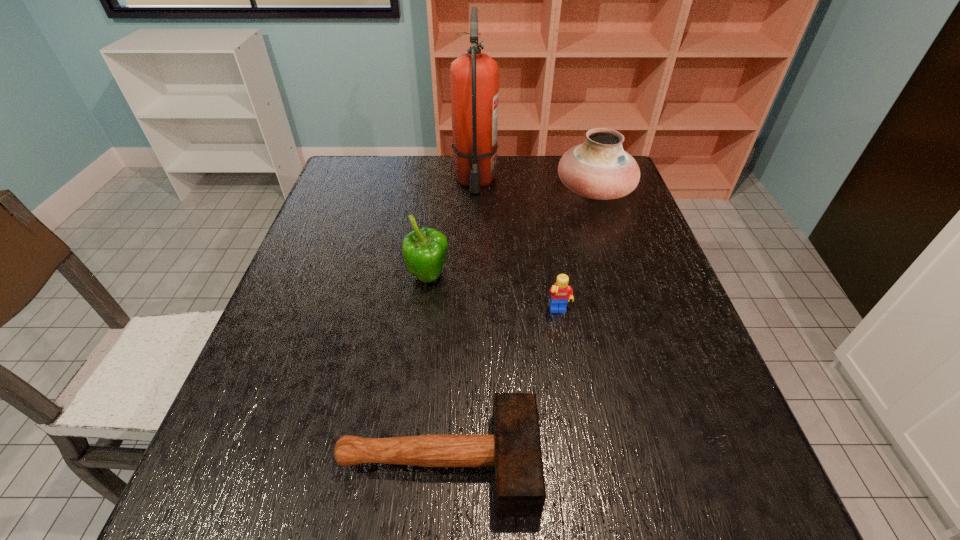
Locate an element on the screen. the fourth closest object to the pottery is located at coordinates (514, 449).

The width and height of the screenshot is (960, 540). I want to click on the second closest object relative to the pottery, so click(561, 292).